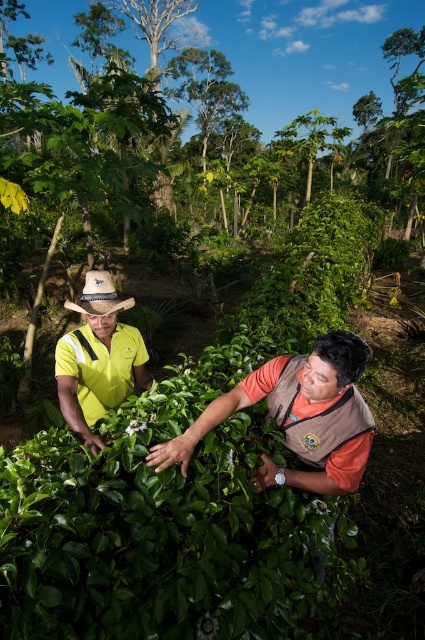
Between green leafy tree at upper center and yellow fabric shirt at left, which one is positioned lower?

yellow fabric shirt at left is below.

Between green leafy tree at upper center and yellow fabric shirt at left, which one is positioned higher?

green leafy tree at upper center is higher up.

Is point (73, 6) farther from viewer compared to point (93, 417)?

That is True.

The width and height of the screenshot is (425, 640). I want to click on green leafy tree at upper center, so click(280, 48).

Between point (340, 397) and point (122, 353), which one is positioned in front?

Positioned in front is point (340, 397).

Does brown vest at center appear over yellow fabric shirt at left?

No.

Locate an element on the screen. brown vest at center is located at coordinates (299, 416).

You are a GUI agent. You are given a task and a screenshot of the screen. Output one action in this format:
    pyautogui.click(x=<x>, y=<y>)
    Task: Click on the brown vest at center
    
    Given the screenshot: What is the action you would take?
    pyautogui.click(x=299, y=416)

In the scene shown: Which is more to the left, green leafy tree at upper center or brown vest at center?

brown vest at center

Who is shorter, green leafy tree at upper center or brown vest at center?

With less height is brown vest at center.

You are a GUI agent. You are given a task and a screenshot of the screen. Output one action in this format:
    pyautogui.click(x=<x>, y=<y>)
    Task: Click on the green leafy tree at upper center
    
    Given the screenshot: What is the action you would take?
    pyautogui.click(x=280, y=48)